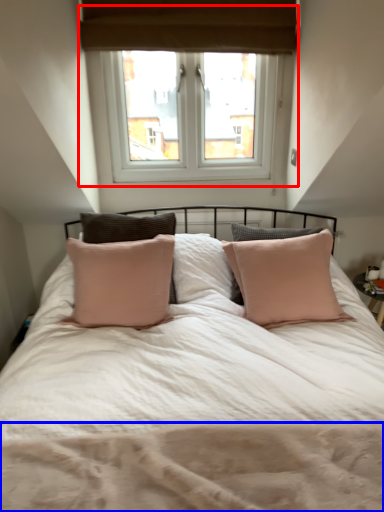
Question: Which of the following is the closest to the observer, window (highlighted by a red box) or mattress (highlighted by a blue box)?

Choices:
 (A) window
 (B) mattress

Answer: (B)